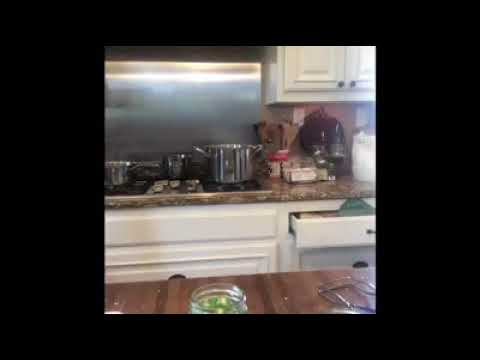
Where is `stove`? This screenshot has width=480, height=360. stove is located at coordinates (220, 191).